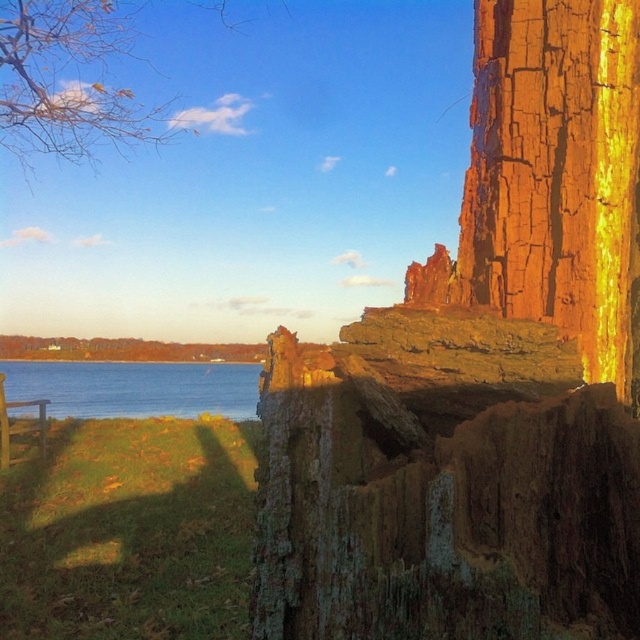
Question: Can you confirm if yellow leafy branches at upper left is thinner than blue water at lower left?

Choices:
 (A) no
 (B) yes

Answer: (B)

Question: Can you confirm if yellow leafy branches at upper left is bigger than blue water at lower left?

Choices:
 (A) no
 (B) yes

Answer: (B)

Question: Which is farther from the blue water at lower left?

Choices:
 (A) rusty metallic cliff at center
 (B) yellow leafy branches at upper left

Answer: (A)

Question: Which point is farther to the camera?

Choices:
 (A) (49, 52)
 (B) (145, 410)
 (C) (595, 320)

Answer: (B)

Question: Which of the following is the closest to the observer?

Choices:
 (A) (225, 10)
 (B) (70, 362)
 (C) (481, 40)

Answer: (C)

Question: Where is yellow leafy branches at upper left located in relation to blue water at lower left in the image?

Choices:
 (A) below
 (B) above

Answer: (B)